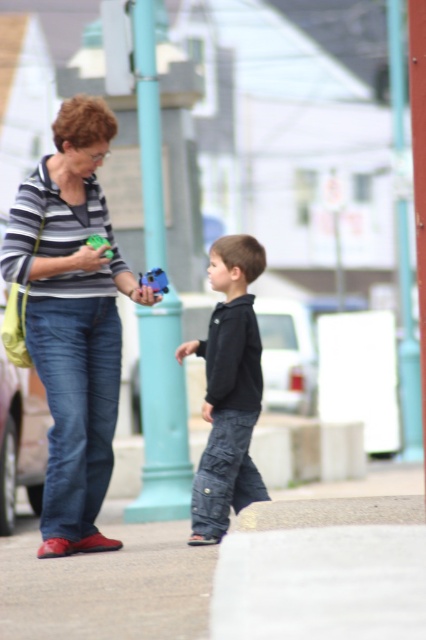
Question: Is gray concrete pavement at lower center closer to the viewer compared to matte plastic toy at center?

Choices:
 (A) no
 (B) yes

Answer: (B)

Question: Among these objects, which one is nearest to the camera?

Choices:
 (A) gray concrete pavement at lower center
 (B) matte striped shirt at center

Answer: (A)

Question: Which object appears closest to the camera in this image?

Choices:
 (A) matte plastic toy at center
 (B) matte striped shirt at center
 (C) black cotton hoodie at center

Answer: (B)

Question: Can you confirm if teal painted pole at center is positioned below matte plastic toy at center?

Choices:
 (A) no
 (B) yes

Answer: (B)

Question: Is matte striped shirt at center thinner than matte plastic toy at center?

Choices:
 (A) yes
 (B) no

Answer: (B)

Question: Which object is closer to the camera taking this photo?

Choices:
 (A) black cotton hoodie at center
 (B) matte striped shirt at center
 (C) teal painted pole at center

Answer: (B)